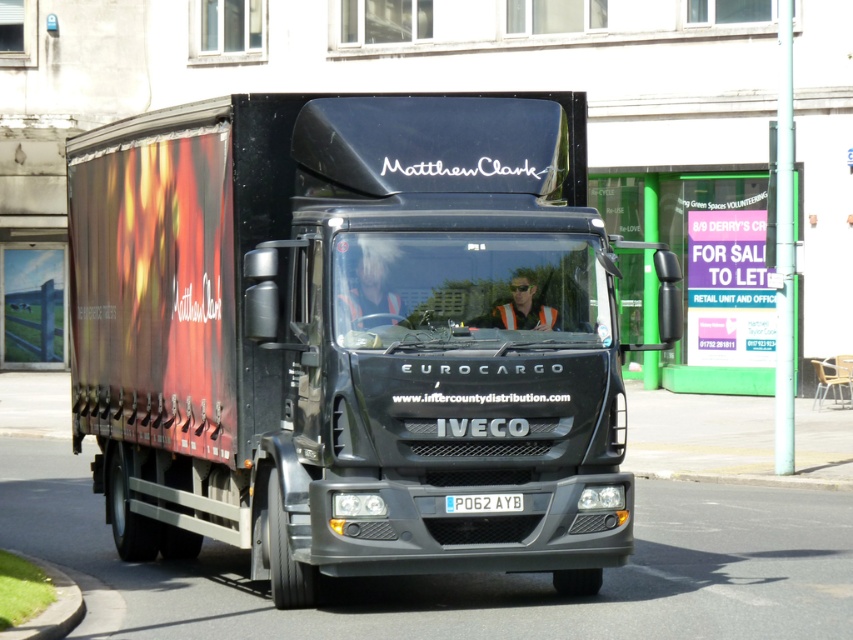
You are standing in front of the black Iveco Eurocargo truck and notice two points marked on its side. The first point is at coordinates point (492, 358) and the second is at point (489, 497). Which of these two points is nearer to your position?

Point (492, 358) is closer to the viewer than point (489, 497).

You are standing on the sidewalk and see the matte black truck at center and the blue metallic license plate at center. Which one is positioned to the left?

The matte black truck at center is positioned to the left of the blue metallic license plate at center.